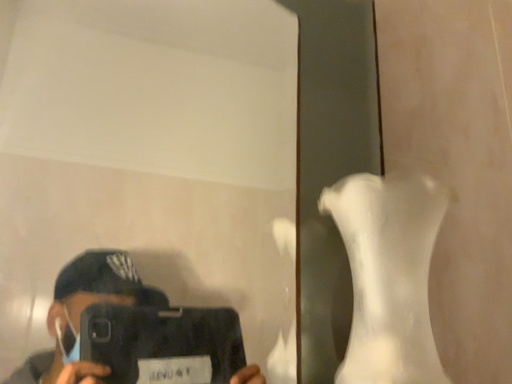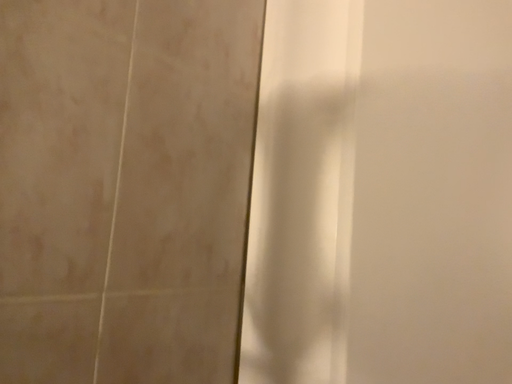
Question: How did the camera likely rotate when shooting the video?

Choices:
 (A) rotated right
 (B) rotated left

Answer: (A)